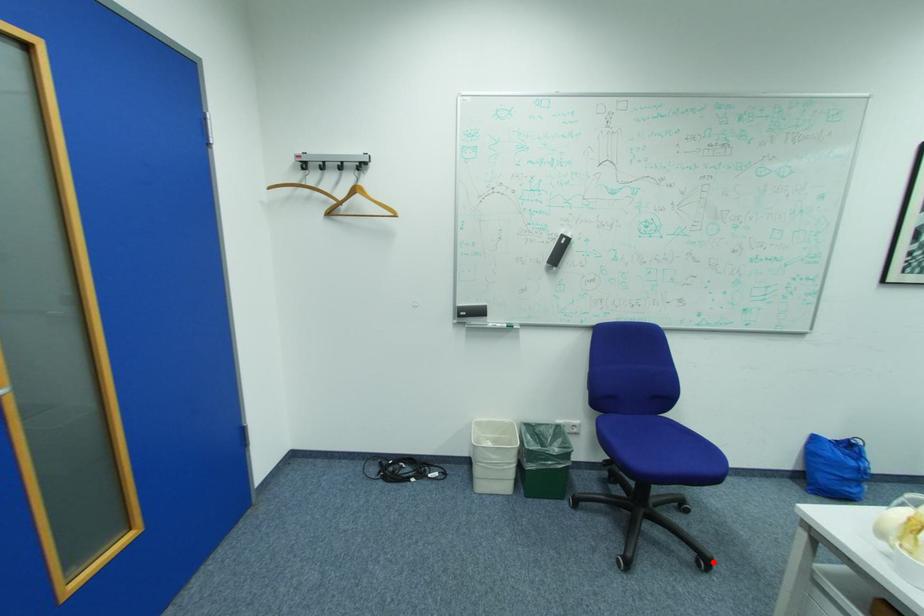
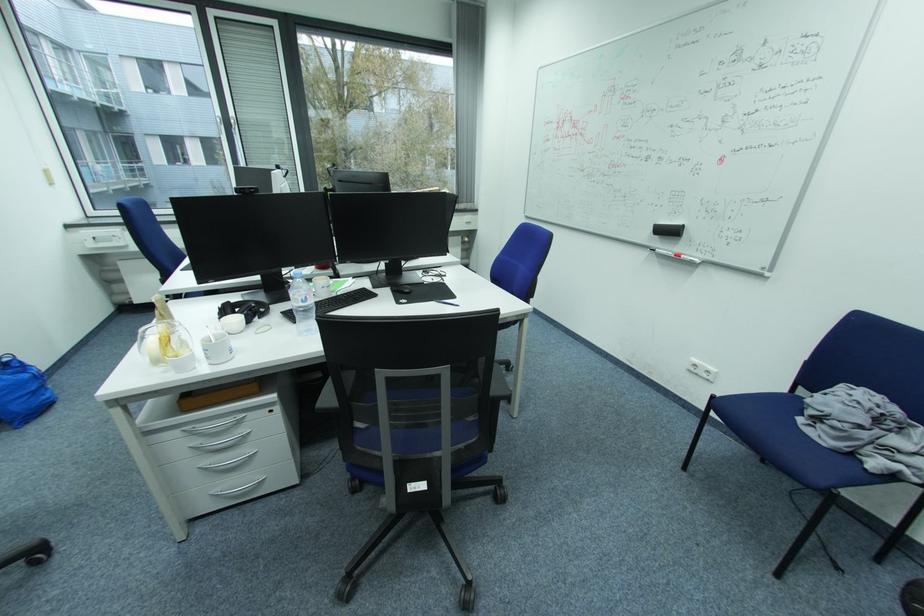
Question: I am providing you with two images of the same scene from different viewpoints. Image1 has a red point marked. In image2, the corresponding 3D location appears at what relative position? Reply with the corresponding letter.

Choices:
 (A) Closer
 (B) Farther

Answer: (A)